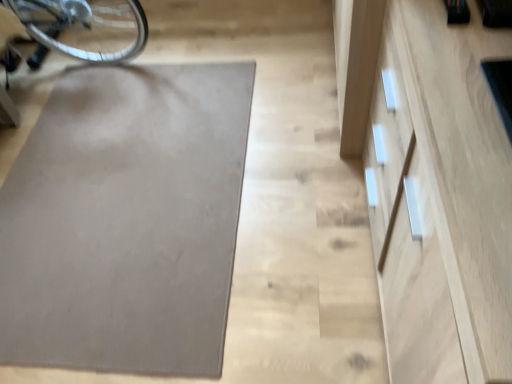
Identify the location of matte gray yoga mat at center. (126, 221).

This screenshot has height=384, width=512. What do you see at coordinates (126, 221) in the screenshot?
I see `matte gray yoga mat at center` at bounding box center [126, 221].

Measure the distance between point (48,193) and camera.

A distance of 5.60 feet exists between point (48,193) and camera.

Find the location of `matte gray yoga mat at center`. matte gray yoga mat at center is located at coordinates (126, 221).